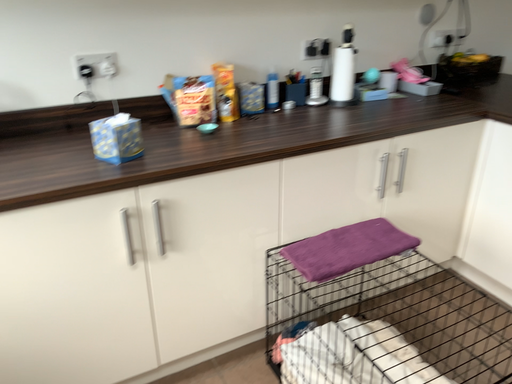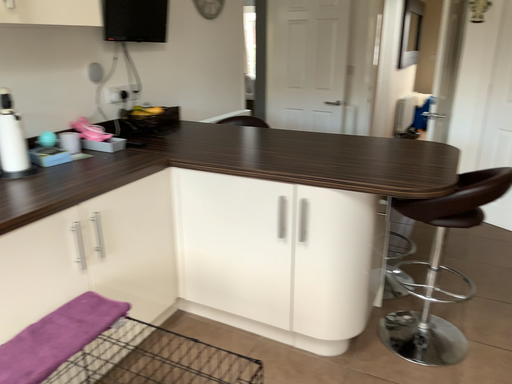
Question: Which way did the camera rotate in the video?

Choices:
 (A) rotated right
 (B) rotated left

Answer: (A)